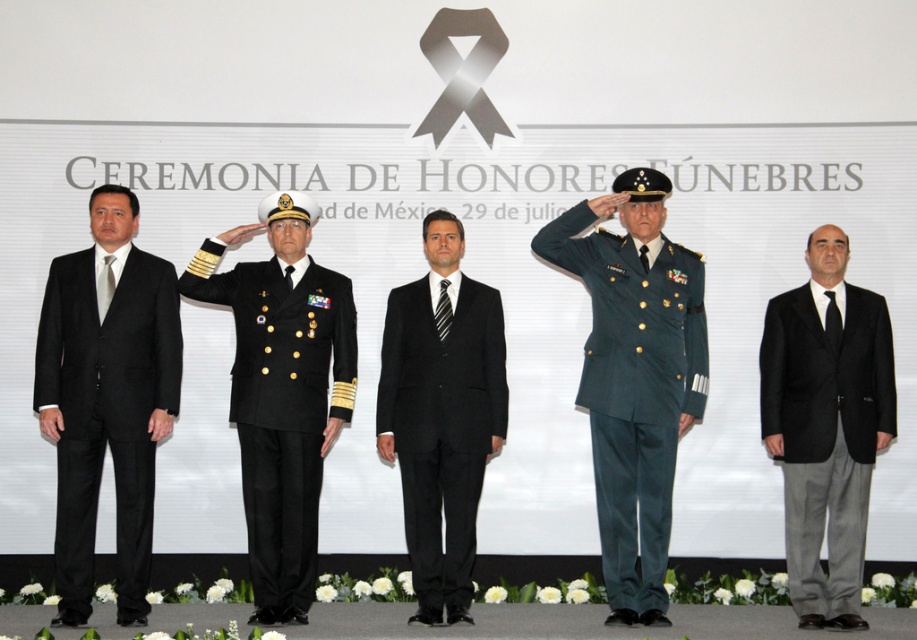
Question: Which object is the closest to the black wool suit at right?

Choices:
 (A) black wool suit at center
 (B) black wool military uniform at center
 (C) satin black suit at left
 (D) green military uniform at center

Answer: (D)

Question: Which point is closer to the camera taking this photo?

Choices:
 (A) (489, 444)
 (B) (289, 294)
 (C) (867, 307)
 (D) (114, 440)

Answer: (D)

Question: Observing the image, what is the correct spatial positioning of green military uniform at center in reference to black wool military uniform at center?

Choices:
 (A) right
 (B) left

Answer: (A)

Question: Which of these objects is positioned closest to the black wool military uniform at center?

Choices:
 (A) green military uniform at center
 (B) satin black suit at left
 (C) black wool suit at center
 (D) black wool suit at right

Answer: (C)

Question: Observing the image, what is the correct spatial positioning of green military uniform at center in reference to black wool suit at center?

Choices:
 (A) below
 (B) above

Answer: (B)

Question: Observing the image, what is the correct spatial positioning of green military uniform at center in reference to black wool military uniform at center?

Choices:
 (A) right
 (B) left

Answer: (A)